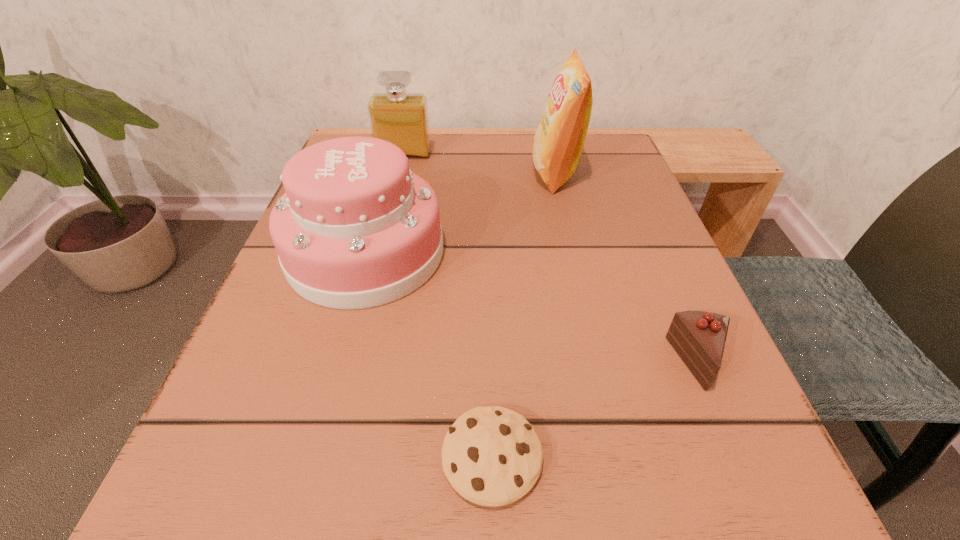
The image size is (960, 540). What are the coordinates of `object that ranks as the closest to the tallest object` in the screenshot? It's located at (355, 229).

This screenshot has height=540, width=960. Find the location of `vacant point that satisfies the following two spatial constraints: 1. on the back side of the shortest object; 2. on the right side of the chocolate cake`. vacant point that satisfies the following two spatial constraints: 1. on the back side of the shortest object; 2. on the right side of the chocolate cake is located at coordinates (490, 362).

Locate an element on the screen. vacant point that satisfies the following two spatial constraints: 1. on the front-facing side of the third object from right to left; 2. on the right side of the perfume is located at coordinates (328, 457).

Where is `vacant area that satisfies the following two spatial constraints: 1. on the front side of the third nearest object; 2. on the right side of the cookie`? vacant area that satisfies the following two spatial constraints: 1. on the front side of the third nearest object; 2. on the right side of the cookie is located at coordinates (308, 457).

At what (x,y) coordinates should I click in order to perform the action: click on free point that satisfies the following two spatial constraints: 1. on the front-facing side of the crisp (potato chip); 2. on the front side of the nearest object. Please return your answer as a coordinate pair (x, y). Image resolution: width=960 pixels, height=540 pixels. Looking at the image, I should click on (621, 457).

The height and width of the screenshot is (540, 960). Identify the location of free space in the image that satisfies the following two spatial constraints: 1. on the back side of the rightmost object; 2. on the left side of the nearest object. (490, 362).

At what (x,y) coordinates should I click in order to perform the action: click on free point that satisfies the following two spatial constraints: 1. on the front-facing side of the crisp (potato chip); 2. on the right side of the chocolate cake. Please return your answer as a coordinate pair (x, y). The image size is (960, 540). Looking at the image, I should click on (599, 362).

Where is `vacant region that satisfies the following two spatial constraints: 1. on the back side of the fourth tallest object; 2. on the front-facing side of the crisp (potato chip)`? The width and height of the screenshot is (960, 540). vacant region that satisfies the following two spatial constraints: 1. on the back side of the fourth tallest object; 2. on the front-facing side of the crisp (potato chip) is located at coordinates (619, 173).